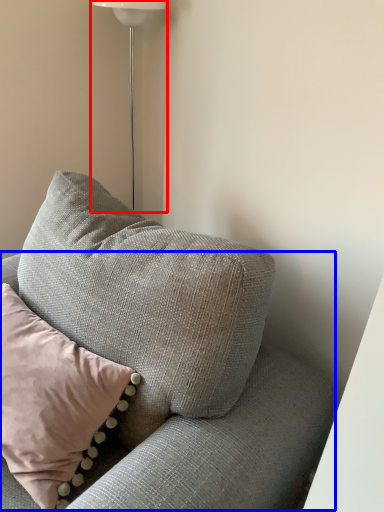
Question: Which of the following is the closest to the observer, lamp (highlighted by a red box) or couch (highlighted by a blue box)?

Choices:
 (A) lamp
 (B) couch

Answer: (B)